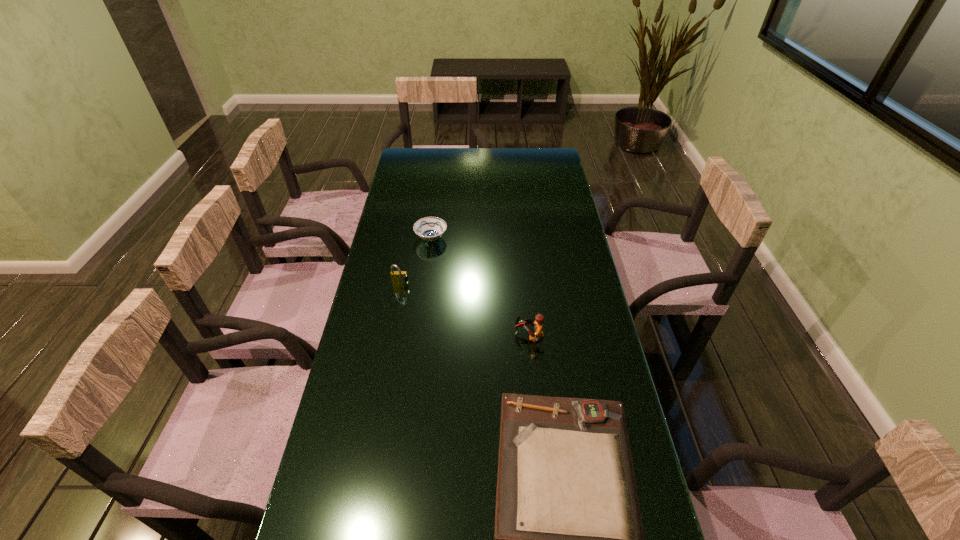
Find the location of a particular element. The height and width of the screenshot is (540, 960). the third farthest object is located at coordinates (539, 318).

Locate an element on the screen. the second farthest object is located at coordinates (398, 277).

Locate an element on the screen. The width and height of the screenshot is (960, 540). the farthest object is located at coordinates (429, 228).

The width and height of the screenshot is (960, 540). Find the location of `the second shortest object`. the second shortest object is located at coordinates (429, 228).

You are a GUI agent. You are given a task and a screenshot of the screen. Output one action in this format:
    pyautogui.click(x=<x>, y=<y>)
    Task: Click on the vacant space located 0.190m holding a crossbow in the hands of the Lego
    This screenshot has width=960, height=540.
    Given the screenshot: What is the action you would take?
    pyautogui.click(x=452, y=336)

I want to click on free space located 0.120m holding a crossbow in the hands of the Lego, so click(x=475, y=336).

The height and width of the screenshot is (540, 960). I want to click on free location located holding a crossbow in the hands of the Lego, so click(452, 336).

In order to click on free space located 0.160m on the side with the combination dials of the third nearest object in this screenshot , I will do `click(393, 325)`.

Where is `vacant space located on the right of the soup bowl`? vacant space located on the right of the soup bowl is located at coordinates (547, 239).

The image size is (960, 540). I want to click on padlock located in the left edge section of the desktop, so click(398, 277).